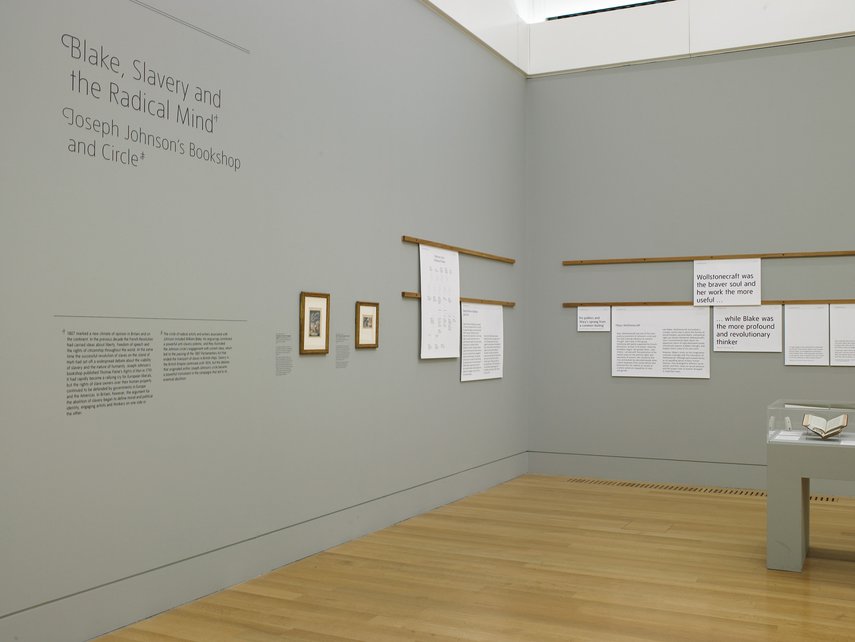
I want to click on 3 areas of words written on the wall, so click(114, 392), click(289, 357), click(346, 370).